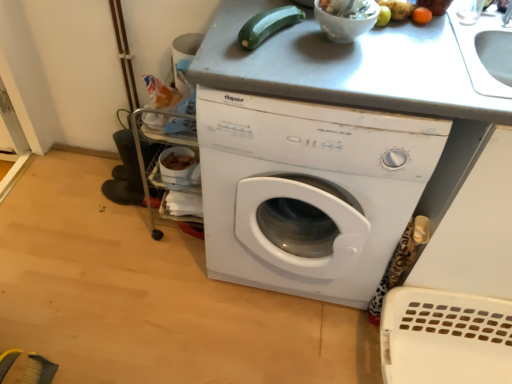
This screenshot has width=512, height=384. I want to click on vacant space that's between white glossy bowl at upper center and green matte zucchini at upper center, which ranks as the 1th vegetable in left-to-right order, so click(315, 53).